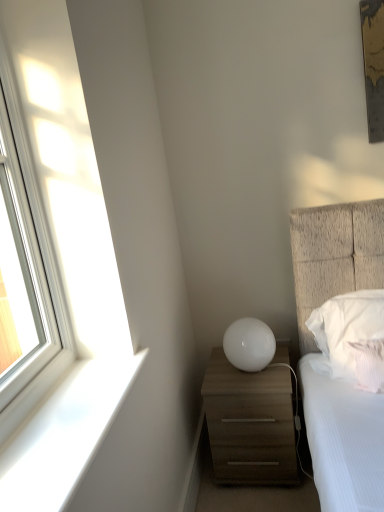
At what (x,y) coordinates should I click in order to perform the action: click on free point above white glossy window sill at left (from a real-world perspective). Please return your answer as a coordinate pair (x, y). Looking at the image, I should click on (76, 411).